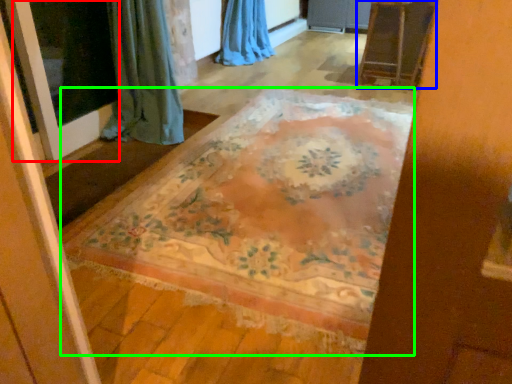
Question: Which is farther away from screen door (highlighted by a red box)? furniture (highlighted by a blue box) or mat (highlighted by a green box)?

Choices:
 (A) furniture
 (B) mat

Answer: (A)